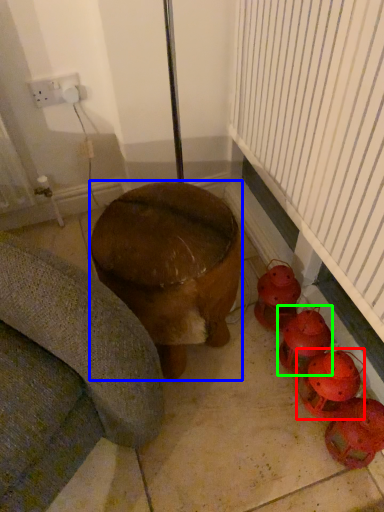
Question: Which object is the farthest from toy (highlighted by a red box)? Choose among these: furniture (highlighted by a blue box) or toy (highlighted by a green box).

Choices:
 (A) furniture
 (B) toy

Answer: (A)